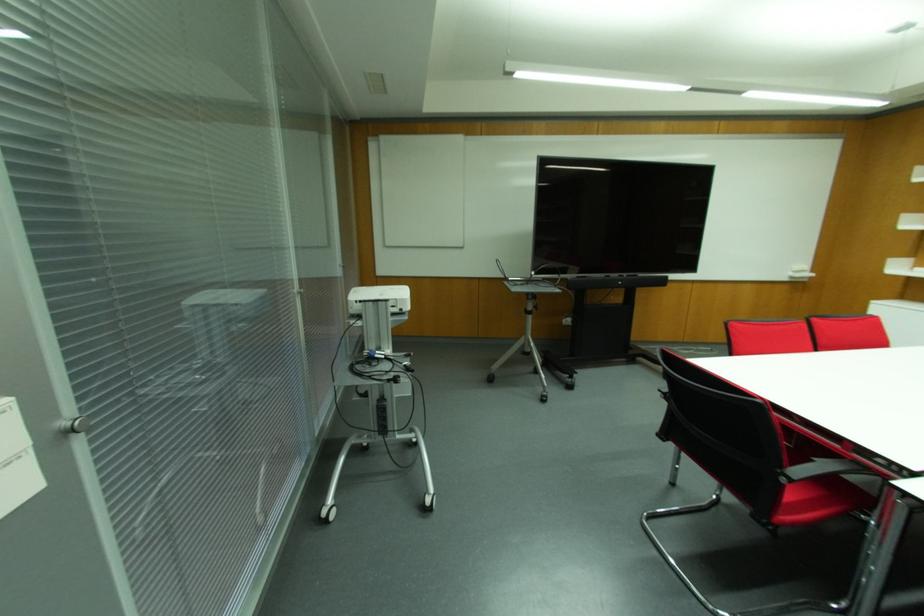
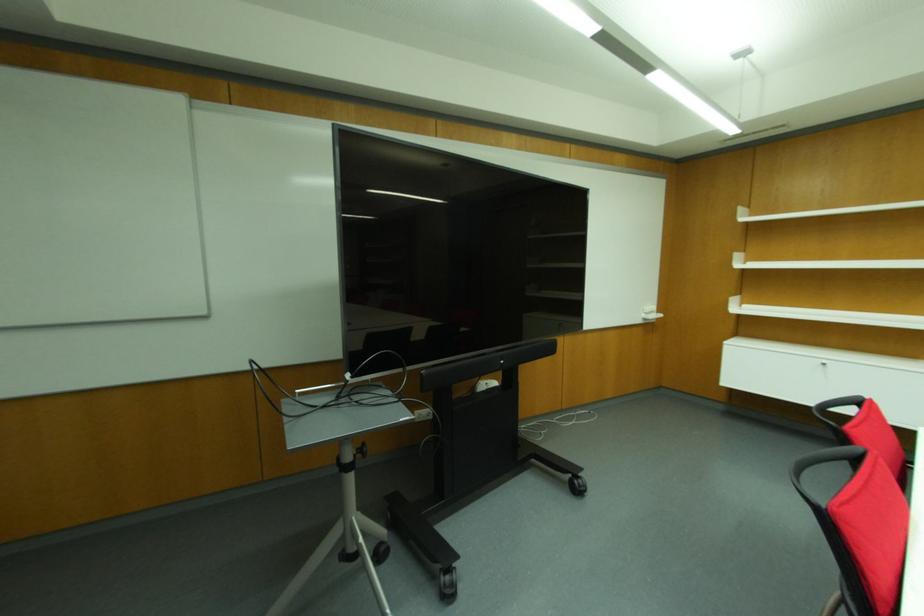
Where in the second image is the point corresponding to pixel 569 387 from the first image?

(448, 594)